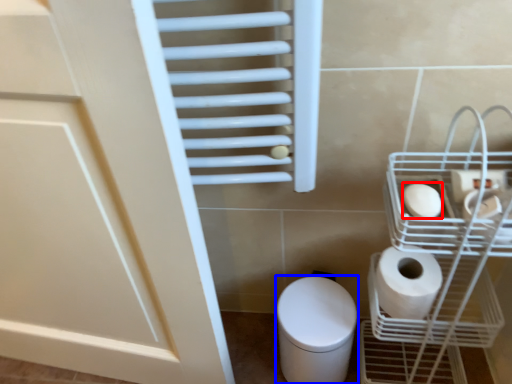
Question: Which object is closer to the camera taking this photo, toilet paper (highlighted by a red box) or bidet (highlighted by a blue box)?

Choices:
 (A) toilet paper
 (B) bidet

Answer: (A)